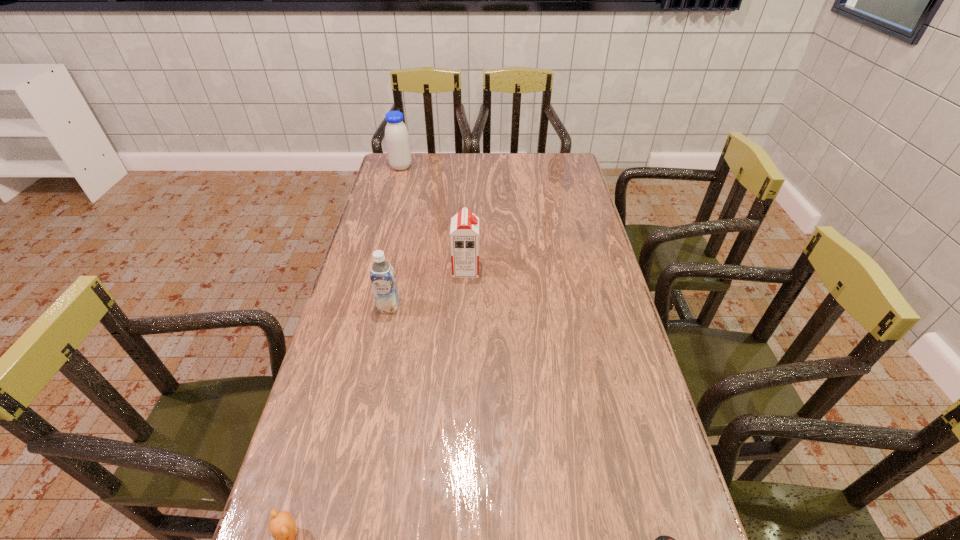
This screenshot has width=960, height=540. In order to click on free location at the left edge in this screenshot , I will do `click(369, 404)`.

In the image, there is a desktop. Where is `vacant space at the right edge`? vacant space at the right edge is located at coordinates pos(558,183).

In the image, there is a desktop. In order to click on free region at the far left corner in this screenshot , I will do `click(387, 158)`.

Locate an element on the screen. Image resolution: width=960 pixels, height=540 pixels. free spot between the farthest soya milk and the second farthest object is located at coordinates (434, 218).

Locate an element on the screen. free space between the second nearest soya milk and the nearest soya milk is located at coordinates (427, 288).

In order to click on free area in between the third nearest object and the rightmost soya milk in this screenshot , I will do `click(427, 288)`.

At what (x,y) coordinates should I click in order to perform the action: click on vacant space that's between the nearest soya milk and the fourth object from left to right. Please return your answer as a coordinate pair (x, y). The image size is (960, 540). Looking at the image, I should click on (427, 288).

What are the coordinates of `object that stands as the second closest to the second nearest soya milk` in the screenshot? It's located at (397, 140).

This screenshot has width=960, height=540. What are the coordinates of `object that is the nearest to the farthest soya milk` in the screenshot? It's located at (464, 233).

Identify which soya milk is located as the nearest to the second farthest object. Please provide its 2D coordinates. Your answer should be formatted as a tuple, i.e. [(x, y)], where the tuple contains the x and y coordinates of a point satisfying the conditions above.

[(382, 275)]